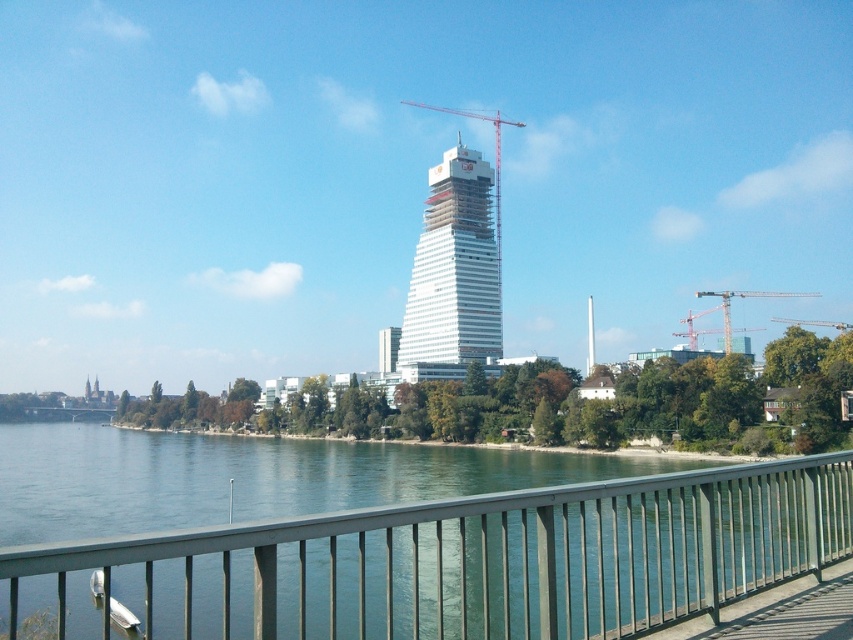
Is metallic gray railing at lower center further to the viewer compared to white glass building at center?

No, metallic gray railing at lower center is in front of white glass building at center.

Which is in front, point (149, 608) or point (474, 326)?

Point (149, 608)

Find the location of a particular element. This screenshot has width=853, height=640. metallic gray railing at lower center is located at coordinates (457, 563).

Can you confirm if white glass building at center is positioned below metallic construction crane at right?

Incorrect, white glass building at center is not positioned below metallic construction crane at right.

This screenshot has width=853, height=640. What do you see at coordinates (454, 268) in the screenshot?
I see `white glass building at center` at bounding box center [454, 268].

You are a GUI agent. You are given a task and a screenshot of the screen. Output one action in this format:
    pyautogui.click(x=<x>, y=<y>)
    Task: Click on the white glass building at center
    
    Given the screenshot: What is the action you would take?
    pyautogui.click(x=454, y=268)

Who is positioned more to the left, metallic construction crane at right or metallic gray crane at center?

From the viewer's perspective, metallic gray crane at center appears more on the left side.

Is metallic construction crane at right wider than metallic gray crane at center?

Yes, metallic construction crane at right is wider than metallic gray crane at center.

This screenshot has width=853, height=640. I want to click on metallic construction crane at right, so click(743, 298).